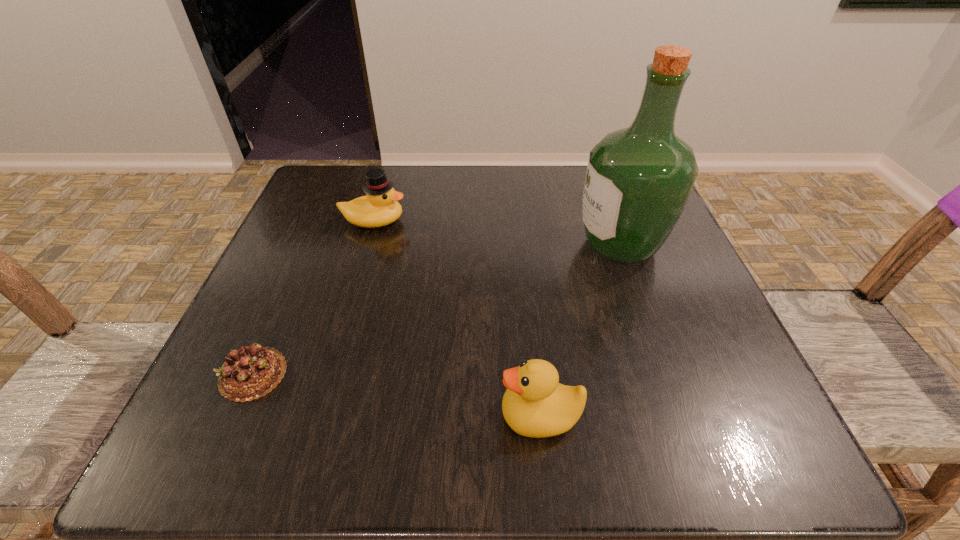
Identify the location of object that ranks as the second closest to the right duck. The width and height of the screenshot is (960, 540). (251, 372).

Image resolution: width=960 pixels, height=540 pixels. I want to click on object identified as the second closest to the chocolate cake, so click(535, 404).

Where is `free space that satisfies the following two spatial constraints: 1. on the front-facing side of the tallest object; 2. on the front side of the chocolate cake`? free space that satisfies the following two spatial constraints: 1. on the front-facing side of the tallest object; 2. on the front side of the chocolate cake is located at coordinates (665, 374).